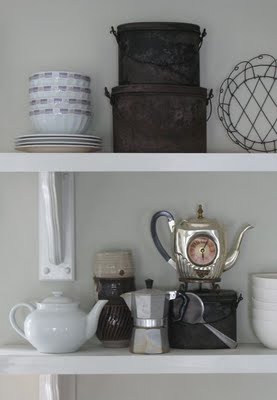
At what (x,y) coordinates should I click in order to perform the action: click on silver spoon. Please return your answer as a coordinate pair (x, y). This screenshot has width=277, height=400. Looking at the image, I should click on (200, 319).